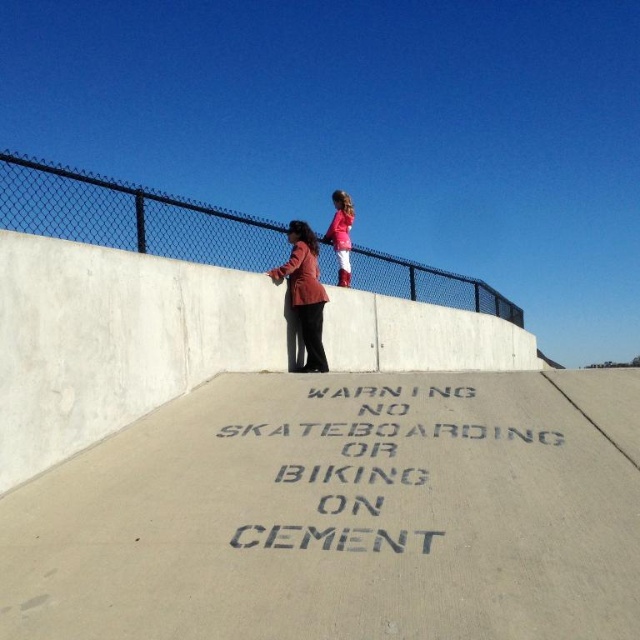
Question: Can you confirm if black chain-link fence at upper center is positioned to the right of matte red jacket at center?

Choices:
 (A) no
 (B) yes

Answer: (B)

Question: Considering the real-world distances, which object is farthest from the black chain-link fence at upper center?

Choices:
 (A) matte red jacket at center
 (B) matte pink jacket at upper center

Answer: (B)

Question: Does black chain-link fence at upper center appear on the left side of matte red jacket at center?

Choices:
 (A) no
 (B) yes

Answer: (A)

Question: Which of the following is the farthest from the observer?

Choices:
 (A) (336, 237)
 (B) (288, 440)

Answer: (A)

Question: Which of the following is the farthest from the observer?

Choices:
 (A) (449, 420)
 (B) (292, 257)
 (C) (22, 184)
 (D) (336, 253)

Answer: (D)

Question: Considering the relative positions of black chain-link fence at upper center and matte pink jacket at upper center in the image provided, where is black chain-link fence at upper center located with respect to matte pink jacket at upper center?

Choices:
 (A) right
 (B) left

Answer: (A)